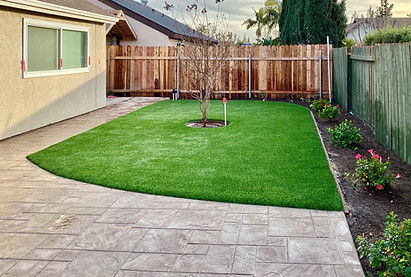
Where is `window handles`? The width and height of the screenshot is (411, 277). window handles is located at coordinates (90, 60), (61, 63), (23, 67).